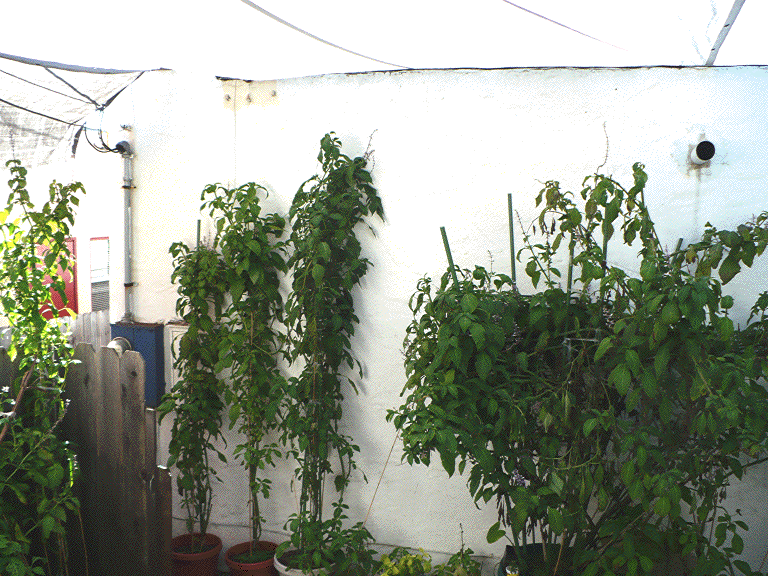
What are the coordinates of `gray pipe on wall` in the screenshot? It's located at (127, 226).